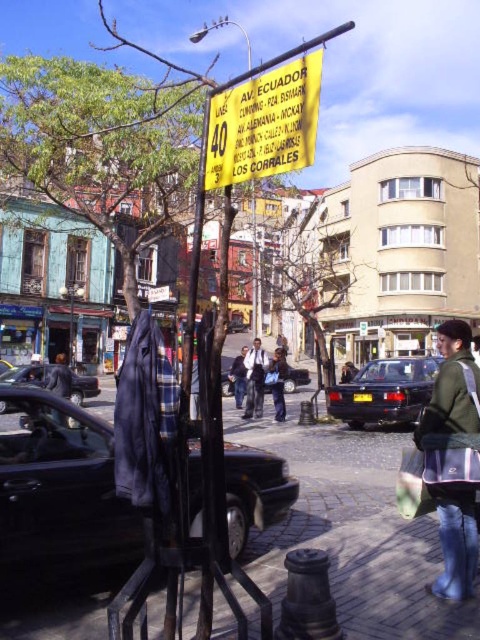
You are standing on the sidewalk in the scene and want to take a photo of the matte black jacket at center and the dark blue metallic sedan at center. Which object should you frame first in your camera viewfinder to ensure both are in the shot?

You should frame the matte black jacket at center first because the dark blue metallic sedan at center is to the right of it, so starting with the jacket ensures the sedan will be included to its right in the frame.

You are standing on the sidewalk in the scene and want to cross the street. There is a dark blue metallic sedan at center and a matte blue jeans at center nearby. Which object is closer to the street?

The dark blue metallic sedan at center is closer to the street because it is to the right of the matte blue jeans at center, which is typically the direction of the street from the sidewalk.